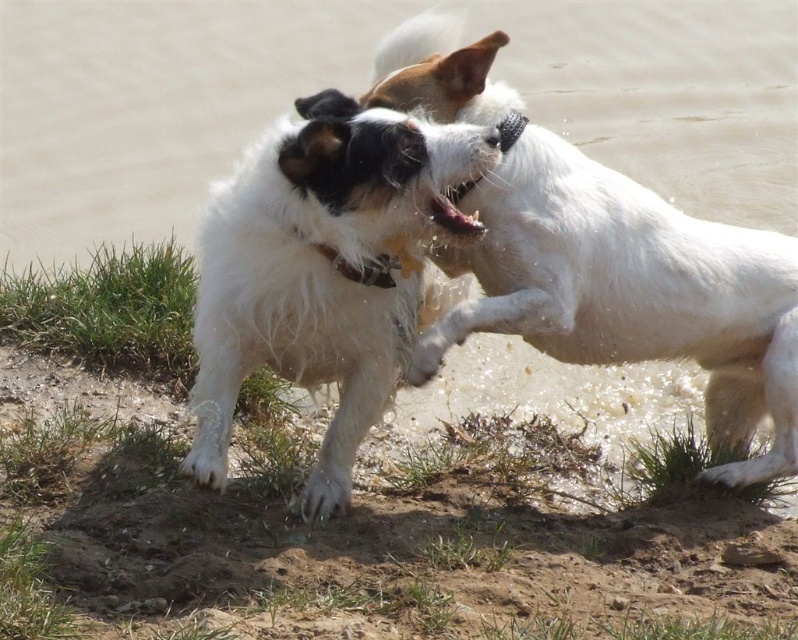
Can you confirm if dry sandy soil at lower center is positioned above white fur dog at center?

Actually, dry sandy soil at lower center is below white fur dog at center.

Who is more forward, (x=401, y=497) or (x=765, y=230)?

Point (x=401, y=497) is more forward.

Locate an element on the screen. The image size is (798, 640). dry sandy soil at lower center is located at coordinates (356, 538).

This screenshot has height=640, width=798. Find the location of `dry sandy soil at lower center`. dry sandy soil at lower center is located at coordinates (356, 538).

Which is above, dry sandy soil at lower center or white fluffy dog at center?

Result: white fluffy dog at center is above.

Is dry sandy soil at lower center taller than white fluffy dog at center?

No, dry sandy soil at lower center is not taller than white fluffy dog at center.

Does point (192, 504) come closer to viewer compared to point (368, 349)?

No, it is behind (368, 349).

Where is `dry sandy soil at lower center`? dry sandy soil at lower center is located at coordinates (356, 538).

Measure the distance from white fur dog at center to white fluffy dog at center.

white fur dog at center and white fluffy dog at center are 46.11 centimeters apart from each other.

From the picture: Does white fur dog at center appear on the left side of white fluffy dog at center?

No, white fur dog at center is not to the left of white fluffy dog at center.

Describe the element at coordinates (631, 291) in the screenshot. I see `white fur dog at center` at that location.

Locate an element on the screen. Image resolution: width=798 pixels, height=640 pixels. white fur dog at center is located at coordinates click(631, 291).